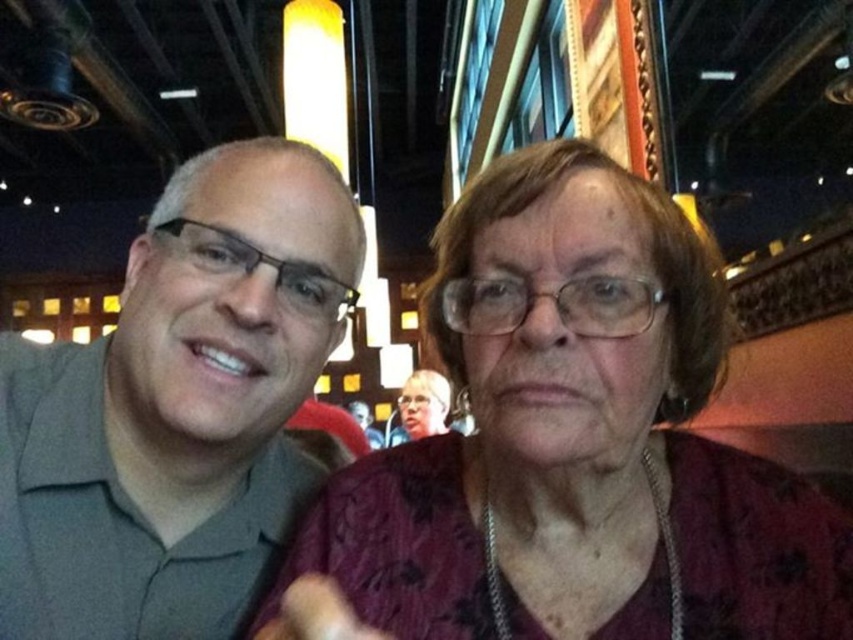
Question: Can you confirm if maroon fabric dress at center is positioned to the left of matte purple blouse at center?

Choices:
 (A) no
 (B) yes

Answer: (A)

Question: Considering the relative positions of maroon fabric dress at center and gray matte shirt at left in the image provided, where is maroon fabric dress at center located with respect to gray matte shirt at left?

Choices:
 (A) below
 (B) above

Answer: (A)

Question: Which of the following is the farthest from the observer?

Choices:
 (A) matte purple blouse at center
 (B) maroon fabric dress at center

Answer: (A)

Question: Which is farther from the maroon fabric dress at center?

Choices:
 (A) matte purple blouse at center
 (B) gray matte shirt at left

Answer: (A)

Question: Which object appears farthest from the camera in this image?

Choices:
 (A) maroon fabric dress at center
 (B) gray matte shirt at left

Answer: (B)

Question: Does gray matte shirt at left appear on the right side of matte purple blouse at center?

Choices:
 (A) no
 (B) yes

Answer: (A)